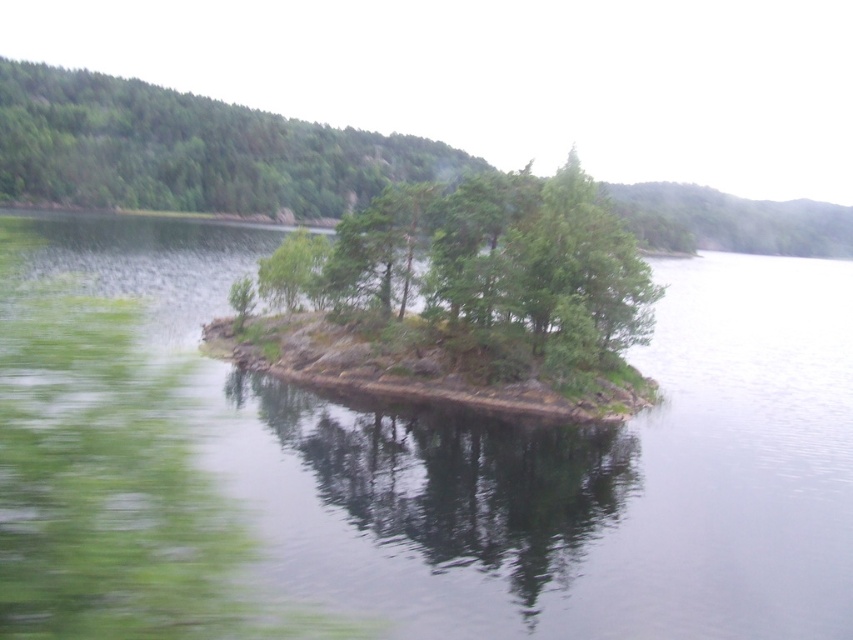
You are a bird flying over the serene natural landscape described in the scene. You notice a specific point marked at coordinates point (498, 273). What type of vegetation can you observe at that exact location?

At point (498, 273) lies green leafy trees at center.

You are a drone operator who needs to land a drone on the island. The drone has a GPS coordinate system where the bottom left corner of the image is the origin point. The island is located at coordinates between 0.6 and 0.8 on the x and y axes. Is the greenish water at center within the island area?

The greenish water at center is located at point (579, 481), which falls within the island area since it is between 0.6 and 0.8 on both axes.